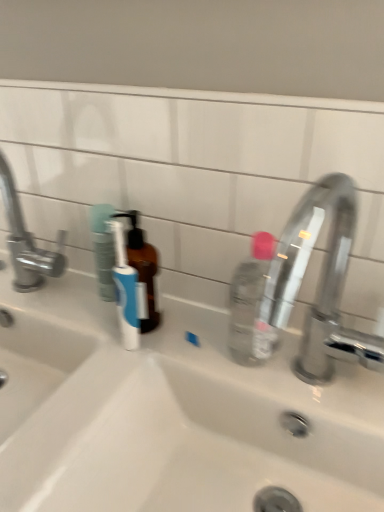
Locate an element on the screen. The height and width of the screenshot is (512, 384). vacant space to the left of polished chrome faucet at right, arranged as the 1th tap when viewed from the right is located at coordinates (233, 370).